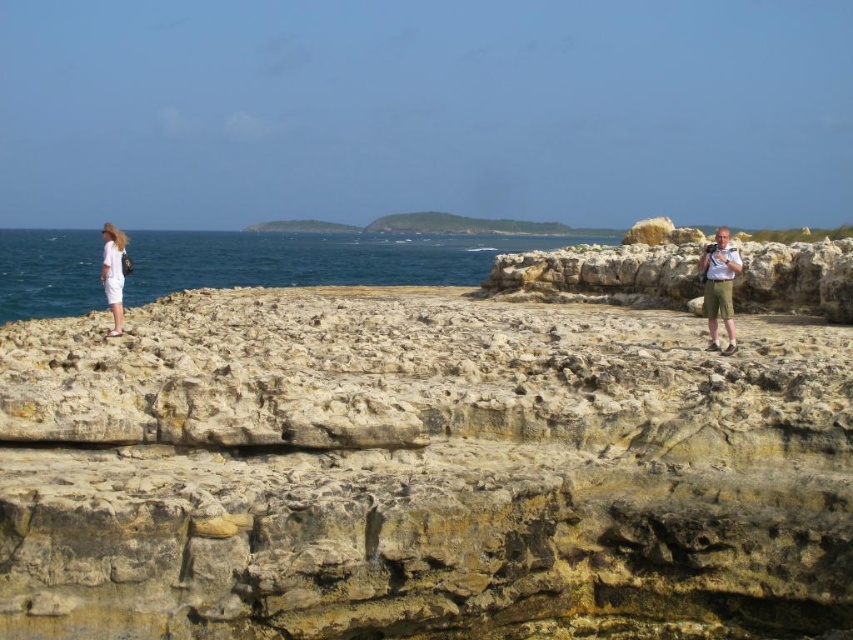
Question: Which point is farther from the camera taking this photo?

Choices:
 (A) (109, 280)
 (B) (242, 492)
 (C) (724, 259)
 (D) (3, 253)

Answer: (D)

Question: Which point is closer to the camera?

Choices:
 (A) khaki shorts at right
 (B) yellowish rock at center
 (C) blue water at left
 (D) white cotton dress at left

Answer: (B)

Question: Is yellowish rock at center to the right of khaki shorts at right from the viewer's perspective?

Choices:
 (A) no
 (B) yes

Answer: (A)

Question: Does yellowish rock at center appear over khaki shorts at right?

Choices:
 (A) no
 (B) yes

Answer: (A)

Question: Estimate the real-world distances between objects in this image. Which object is closer to the khaki shorts at right?

Choices:
 (A) blue water at left
 (B) white cotton dress at left
 (C) yellowish rock at center

Answer: (C)

Question: Does yellowish rock at center have a greater width compared to khaki shorts at right?

Choices:
 (A) yes
 (B) no

Answer: (B)